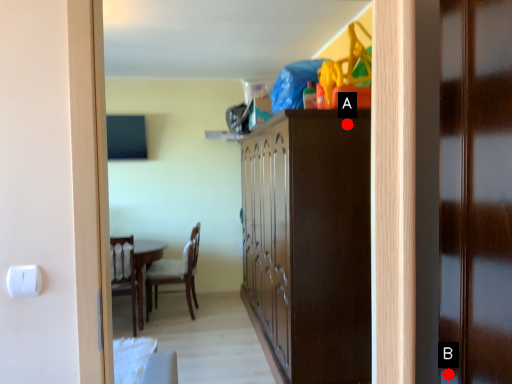
Question: Two points are circled on the image, labeled by A and B beside each circle. Which point is farther from the camera taking this photo?

Choices:
 (A) A is further
 (B) B is further

Answer: (A)